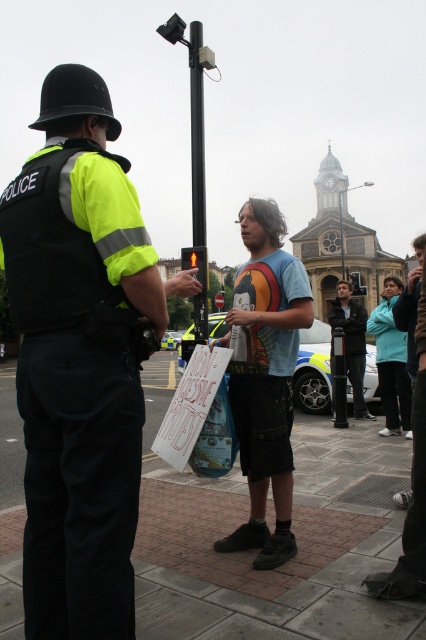
Question: Which of the following is the closest to the observer?

Choices:
 (A) (195, 230)
 (B) (80, 173)
 (C) (149, 536)
 (D) (333, 321)

Answer: (B)

Question: Which of these objects is positioned farthest from the matte black jacket at center?

Choices:
 (A) metallic pole at center
 (B) light blue t-shirt at center
 (C) brick pavement at center

Answer: (B)

Question: Which is farther from the matte black jacket at center?

Choices:
 (A) matte black uniform at center
 (B) metallic pole at center

Answer: (A)

Question: Is light blue t-shirt at center to the left of matte black jacket at center from the viewer's perspective?

Choices:
 (A) no
 (B) yes

Answer: (B)

Question: Is light blue t-shirt at center to the right of matte black jacket at center from the viewer's perspective?

Choices:
 (A) yes
 (B) no

Answer: (B)

Question: Does light blue t-shirt at center have a larger size compared to metallic pole at center?

Choices:
 (A) no
 (B) yes

Answer: (A)